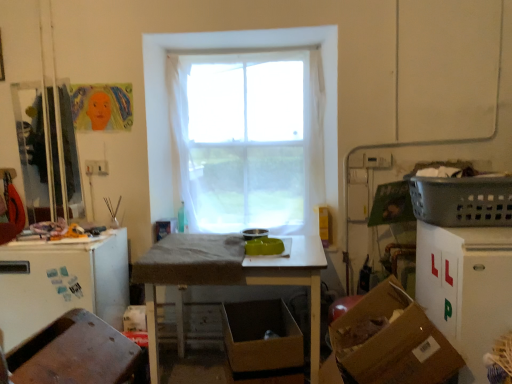
Locate an element on the screen. Image resolution: width=512 pixels, height=384 pixels. free spot above translucent fabric window at center (from a real-world perspective) is located at coordinates (247, 54).